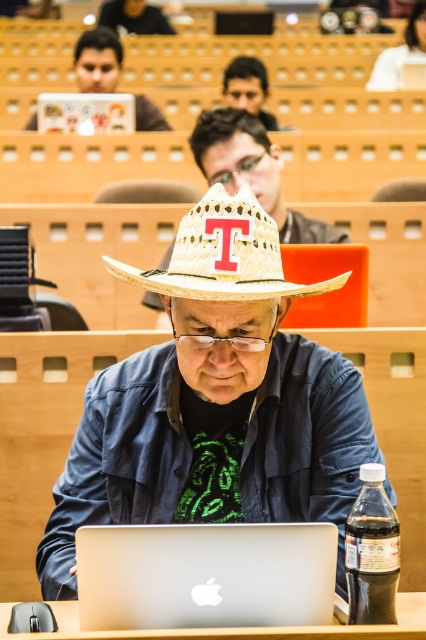
Between point (278, 236) and point (226, 83), which one is positioned in front?

Point (278, 236) is more forward.

Is point (256, 266) positioned in front of point (247, 97)?

Yes, point (256, 266) is in front of point (247, 97).

The width and height of the screenshot is (426, 640). Identify the location of white woven straw hat at center. (224, 253).

Does straw hat at center come in front of matte brown hat at upper center?

Yes, it is.

Who is positioned more to the left, straw hat at center or matte brown hat at upper center?

straw hat at center is more to the left.

This screenshot has height=640, width=426. I want to click on straw hat at center, so click(x=215, y=403).

The image size is (426, 640). What are the coordinates of `straw hat at center` in the screenshot? It's located at pos(215,403).

Is silver metallic table at lower center above matte brown hat at upper center?

No, silver metallic table at lower center is not above matte brown hat at upper center.

Does silver metallic table at lower center have a smaller size compared to matte brown hat at upper center?

Correct, silver metallic table at lower center occupies less space than matte brown hat at upper center.

Describe the element at coordinates (236, 627) in the screenshot. I see `silver metallic table at lower center` at that location.

Locate an element on the screen. Image resolution: width=426 pixels, height=640 pixels. silver metallic table at lower center is located at coordinates (236, 627).